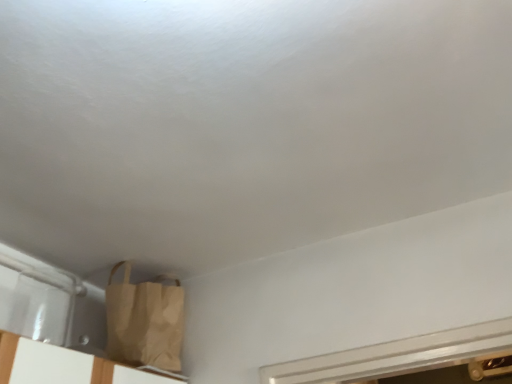
What do you see at coordinates (144, 322) in the screenshot? I see `brown paper bag at lower left` at bounding box center [144, 322].

You are a GUI agent. You are given a task and a screenshot of the screen. Output one action in this format:
    pyautogui.click(x=<x>, y=<y>)
    Task: Click on the brown paper bag at lower left
    Image resolution: width=512 pixels, height=384 pixels.
    Given the screenshot: What is the action you would take?
    pyautogui.click(x=144, y=322)

At what (x,y) coordinates should I click in order to perform the action: click on brown paper bag at lower left. Please return your answer as a coordinate pair (x, y). This screenshot has height=384, width=512. Looking at the image, I should click on (144, 322).